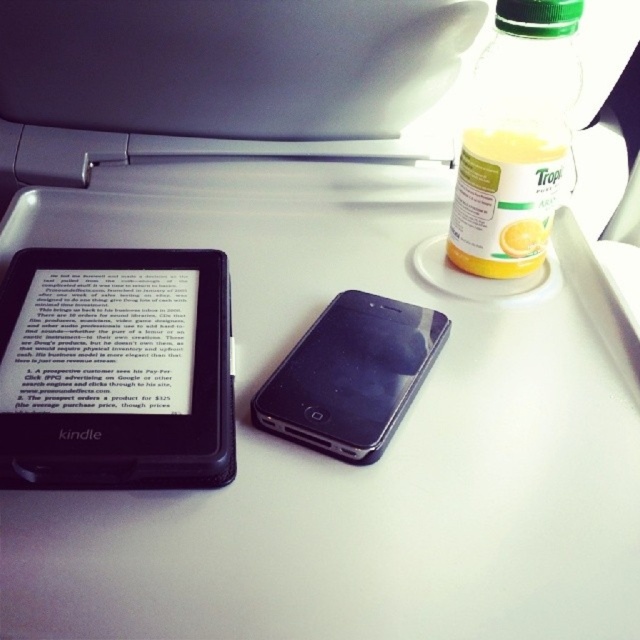
You are a flight attendant checking the items on a passenger tray table. You see the translucent plastic bottle at upper right and the translucent plastic bottle of orange juice at upper right. Which one is positioned more to the right?

The translucent plastic bottle at upper right is positioned more to the right than the translucent plastic bottle of orange juice at upper right.

You are a passenger on an airplane and want to place a 12 inch long book on the tray table. The tray table has a point at coordinates point [38,390] that is 17.81 inches from you. Can you fit the book horizontally on the tray table without it hanging over the edges?

The point at point [38,390] is 17.81 inches from the viewer. Since the book is 12 inches long, it can fit horizontally on the tray table as 12 inches is less than 17.81 inches.